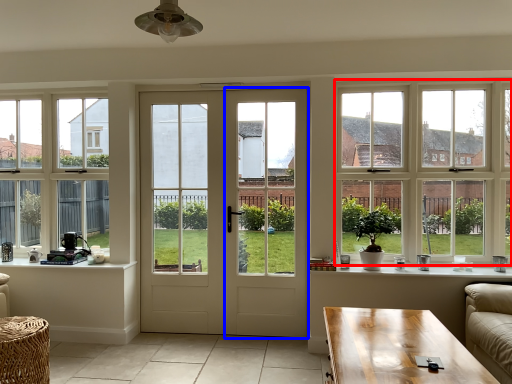
Question: Among these objects, which one is nearest to the camera, window (highlighted by a red box) or screen door (highlighted by a blue box)?

Choices:
 (A) window
 (B) screen door

Answer: (A)